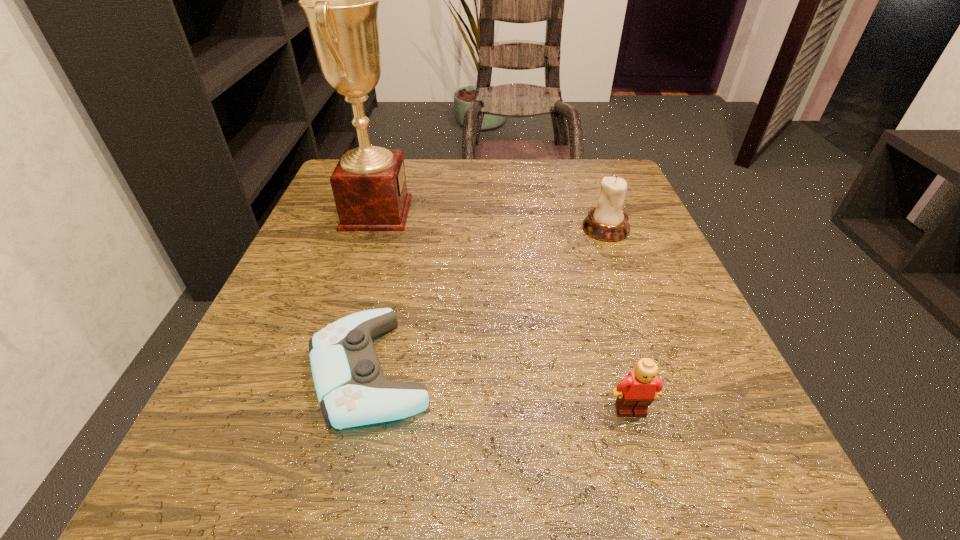
Choose which object is the second nearest neighbor to the Lego. Please provide its 2D coordinates. Your answer should be formatted as a tuple, i.e. [(x, y)], where the tuple contains the x and y coordinates of a point satisfying the conditions above.

[(607, 222)]

Find the location of a particular element. The height and width of the screenshot is (540, 960). blank space that satisfies the following two spatial constraints: 1. on the plaque of the trophy cup; 2. on the right side of the shortest object is located at coordinates (325, 370).

What are the coordinates of `free space that satisfies the following two spatial constraints: 1. on the plaque of the trophy cup; 2. on the left side of the shortest object` in the screenshot? It's located at (325, 370).

The image size is (960, 540). I want to click on vacant area in the image that satisfies the following two spatial constraints: 1. on the plaque of the third shortest object; 2. on the right side of the trophy cup, so click(x=372, y=228).

Where is `vacant space that satisfies the following two spatial constraints: 1. on the plaque of the trophy cup; 2. on the back side of the candle holder`? vacant space that satisfies the following two spatial constraints: 1. on the plaque of the trophy cup; 2. on the back side of the candle holder is located at coordinates (372, 228).

This screenshot has height=540, width=960. Identify the location of free space that satisfies the following two spatial constraints: 1. on the plaque of the trophy cup; 2. on the back side of the second tallest object. (372, 228).

Find the location of a particular element. free location that satisfies the following two spatial constraints: 1. on the plaque of the control; 2. on the left side of the trophy cup is located at coordinates [325, 370].

This screenshot has height=540, width=960. What are the coordinates of `vacant space that satisfies the following two spatial constraints: 1. on the plaque of the trophy cup; 2. on the back side of the control` in the screenshot? It's located at click(x=325, y=370).